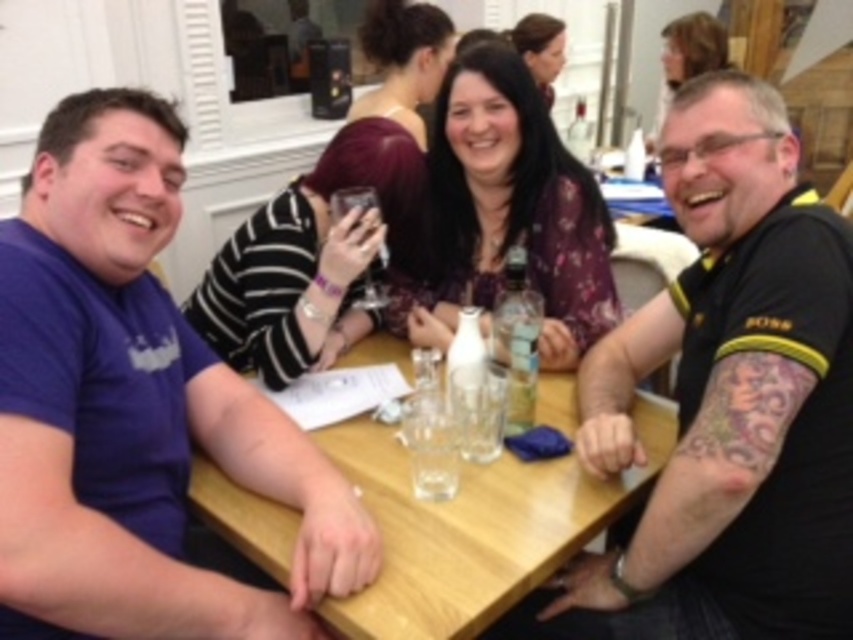
Question: Which point is closer to the camera taking this photo?

Choices:
 (A) (554, 300)
 (B) (535, 500)
 (C) (218, 417)
 (D) (692, 355)

Answer: (B)

Question: Can you confirm if floral-patterned blouse at center is wider than transparent glass at table center?

Choices:
 (A) no
 (B) yes

Answer: (B)

Question: Can you confirm if wooden table at center is wider than floral-patterned blouse at center?

Choices:
 (A) no
 (B) yes

Answer: (B)

Question: Is the position of wooden table at center less distant than that of floral-patterned blouse at center?

Choices:
 (A) yes
 (B) no

Answer: (A)

Question: Which object appears closest to the camera in this image?

Choices:
 (A) wooden table at center
 (B) floral-patterned blouse at center
 (C) transparent glass at table center

Answer: (A)

Question: Which point is closer to the camera taking this photo?

Choices:
 (A) pos(439,477)
 (B) pos(189,339)

Answer: (A)